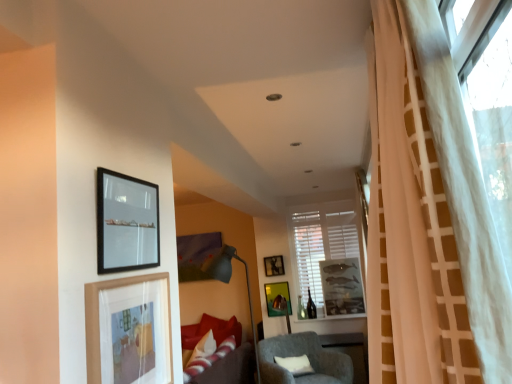
Question: Is matte black picture frame at upper center, the 3th picture frame in the right-to-left sequence, taller than black matte picture frame at upper left, which is the 2th picture frame from front to back?

Choices:
 (A) no
 (B) yes

Answer: (A)

Question: Considering the relative positions of matte black picture frame at upper center, which appears as the 5th picture frame when viewed from the front, and black matte picture frame at upper left, which ranks as the 5th picture frame in right-to-left order, in the image provided, is matte black picture frame at upper center, which appears as the 5th picture frame when viewed from the front, to the left of black matte picture frame at upper left, which ranks as the 5th picture frame in right-to-left order, from the viewer's perspective?

Choices:
 (A) yes
 (B) no

Answer: (B)

Question: Is matte black picture frame at upper center, which is the first picture frame from back to front, further to the viewer compared to black matte picture frame at upper left, which is the 2th picture frame from front to back?

Choices:
 (A) no
 (B) yes

Answer: (B)

Question: Is matte black picture frame at upper center, which is the first picture frame from back to front, facing away from black matte picture frame at upper left, marked as the 1th picture frame in a left-to-right arrangement?

Choices:
 (A) yes
 (B) no

Answer: (B)

Question: Is black matte picture frame at upper left, the fourth picture frame positioned from the back, a part of matte black picture frame at upper center, the 3th picture frame in the left-to-right sequence?

Choices:
 (A) no
 (B) yes

Answer: (A)

Question: Can you confirm if matte black picture frame at upper center, the 3th picture frame in the right-to-left sequence, is smaller than black matte picture frame at upper left, marked as the 1th picture frame in a left-to-right arrangement?

Choices:
 (A) yes
 (B) no

Answer: (A)

Question: Is white matte window at center facing away from wooden picture frame at lower left, placed as the 4th picture frame when sorted from right to left?

Choices:
 (A) no
 (B) yes

Answer: (A)

Question: From the image's perspective, would you say white matte window at center is positioned over wooden picture frame at lower left, acting as the 1th picture frame starting from the front?

Choices:
 (A) no
 (B) yes

Answer: (A)

Question: Is white matte window at center shorter than wooden picture frame at lower left, the second picture frame in the left-to-right sequence?

Choices:
 (A) no
 (B) yes

Answer: (A)

Question: Can you confirm if white matte window at center is bigger than wooden picture frame at lower left, placed as the 4th picture frame when sorted from right to left?

Choices:
 (A) yes
 (B) no

Answer: (A)

Question: Can you confirm if white matte window at center is smaller than wooden picture frame at lower left, marked as the fifth picture frame in a back-to-front arrangement?

Choices:
 (A) no
 (B) yes

Answer: (A)

Question: Are white matte window at center and wooden picture frame at lower left, marked as the fifth picture frame in a back-to-front arrangement, far apart?

Choices:
 (A) no
 (B) yes

Answer: (B)

Question: Considering the relative sizes of matte gray floor lamp at center and metallic gold picture frame at center, which is the second picture frame from right to left, in the image provided, is matte gray floor lamp at center smaller than metallic gold picture frame at center, which is the second picture frame from right to left,?

Choices:
 (A) no
 (B) yes

Answer: (A)